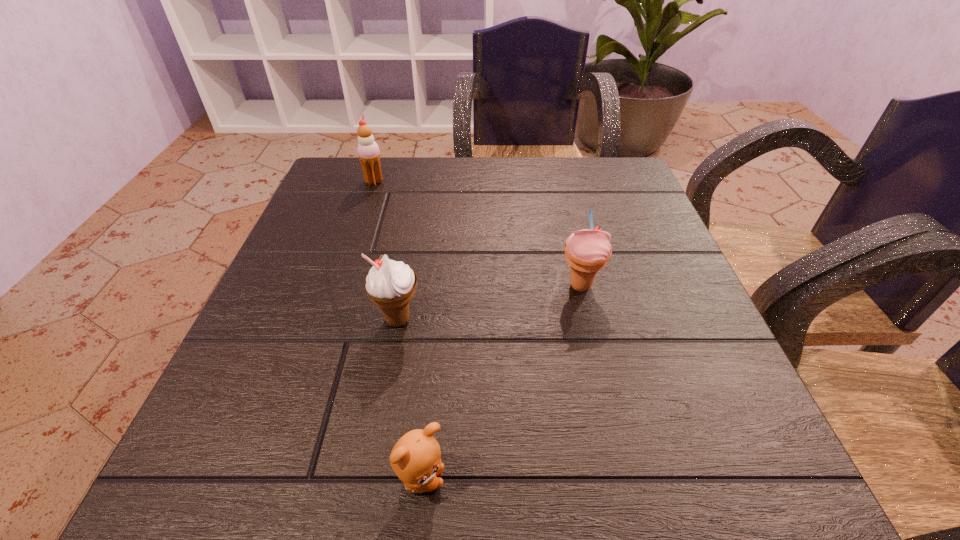
At what (x,y) coordinates should I click in order to perform the action: click on free space that satisfies the following two spatial constraints: 1. at the front with a straw on the rightmost icecream; 2. on the left side of the farthest icecream. Please return your answer as a coordinate pair (x, y). Image resolution: width=960 pixels, height=540 pixels. Looking at the image, I should click on (x=339, y=286).

Where is `blank area in the image that satisfies the following two spatial constraints: 1. at the front with a straw on the leftmost icecream; 2. on the back side of the second icecream from left to right`? blank area in the image that satisfies the following two spatial constraints: 1. at the front with a straw on the leftmost icecream; 2. on the back side of the second icecream from left to right is located at coordinates (327, 320).

Locate an element on the screen. vacant area that satisfies the following two spatial constraints: 1. at the front with a straw on the farthest object; 2. on the right side of the rightmost object is located at coordinates (339, 286).